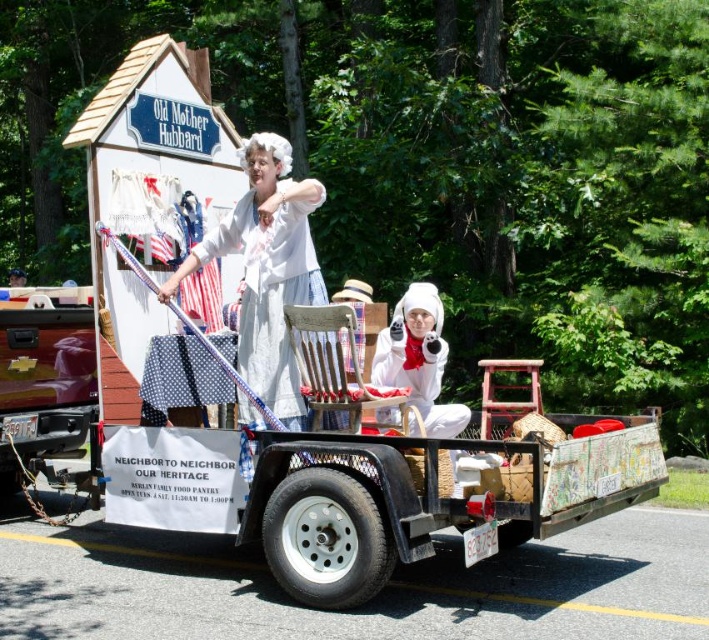
Question: In this image, where is white cotton dress at center located relative to white fluffy costume at center?

Choices:
 (A) left
 (B) right

Answer: (A)

Question: Does white cotton dress at center appear under white fluffy costume at center?

Choices:
 (A) yes
 (B) no

Answer: (B)

Question: Where is white cotton dress at center located in relation to white fluffy costume at center in the image?

Choices:
 (A) above
 (B) below

Answer: (A)

Question: Which object appears closest to the camera in this image?

Choices:
 (A) white fluffy costume at center
 (B) white cotton dress at center

Answer: (B)

Question: Which of the following is the closest to the observer?

Choices:
 (A) white fluffy costume at center
 (B) white cotton dress at center

Answer: (B)